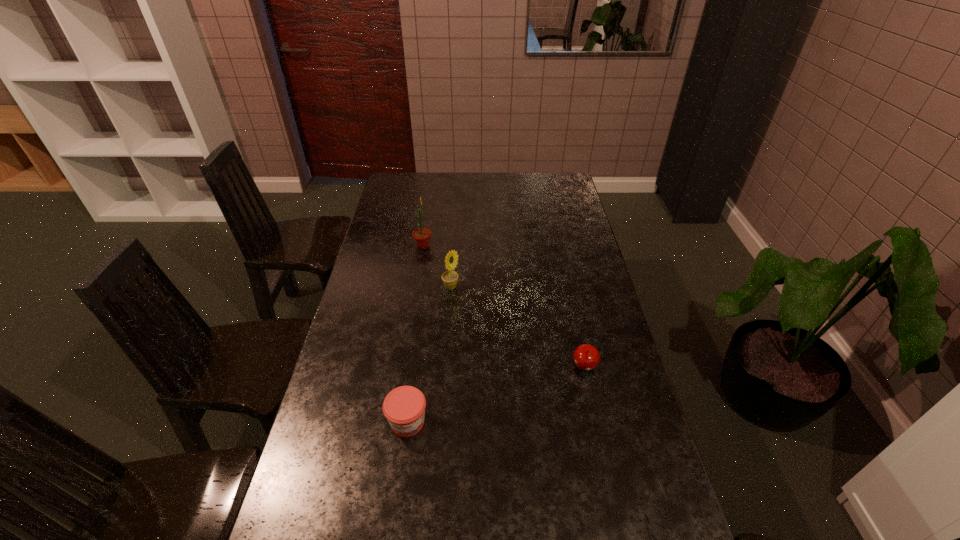
You are a GUI agent. You are given a task and a screenshot of the screen. Output one action in this format:
    pyautogui.click(x=<x>, y=<y>)
    Task: Click on the free location that satisfies the following two spatial constraints: 1. on the face of the right sunflower; 2. on the back side of the cherry
    
    Given the screenshot: What is the action you would take?
    tap(444, 368)

Locate an element on the screen. free space that satisfies the following two spatial constraints: 1. on the face of the taller sunflower; 2. on the back side of the rightmost object is located at coordinates (403, 368).

The height and width of the screenshot is (540, 960). In order to click on free region that satisfies the following two spatial constraints: 1. on the face of the second nearest object; 2. on the right side of the farther sunflower in this screenshot , I will do `click(403, 368)`.

Image resolution: width=960 pixels, height=540 pixels. In order to click on free space that satisfies the following two spatial constraints: 1. on the face of the farthest object; 2. on the left side of the rightmost object in this screenshot , I will do `click(403, 368)`.

The width and height of the screenshot is (960, 540). What are the coordinates of `free space that satisfies the following two spatial constraints: 1. on the face of the cherry; 2. on the left side of the second farthest object` in the screenshot? It's located at (444, 368).

The width and height of the screenshot is (960, 540). What are the coordinates of `vacant area in the image that satisfies the following two spatial constraints: 1. on the back side of the second nearest object; 2. on the face of the farther sunflower` in the screenshot? It's located at pyautogui.click(x=558, y=246).